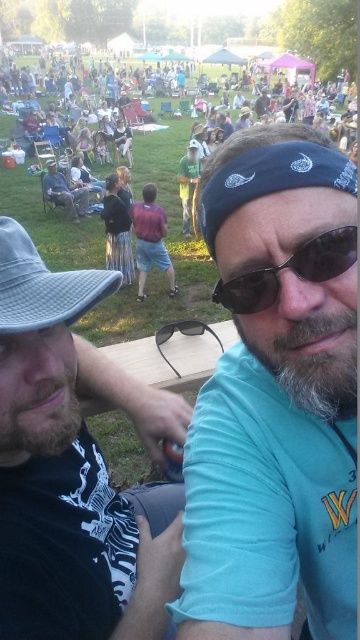
You are at the festival and want to locate the blue bandana at center and the matte black jacket at center. If you are facing the scene, which object is positioned to the left?

The matte black jacket at center is to the left of the blue bandana at center.

You are a photographer at the event and want to take a photo that includes both the beige fabric hat at left and the black plastic goggles at center. Based on their positions, which object should appear lower in the photo?

The beige fabric hat at left should appear lower in the photo because it is positioned below the black plastic goggles at center.

You are at the point labeled point (51, 305) and want to walk to the point labeled point (74, 550). Which direction should you move to reach your destination?

To reach point (74, 550) from point (51, 305), you should move forward since point (74, 550) is behind point (51, 305).